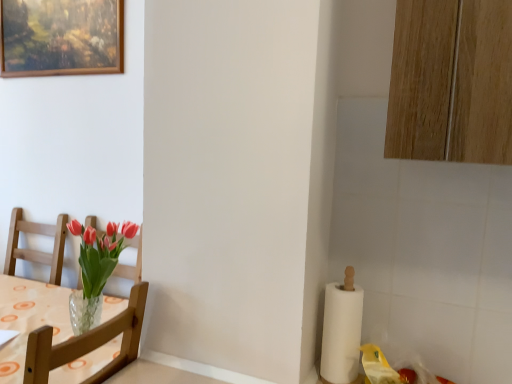
Where is `white paper at right`? This screenshot has height=384, width=512. white paper at right is located at coordinates (341, 333).

Image resolution: width=512 pixels, height=384 pixels. What do you see at coordinates (341, 333) in the screenshot? I see `white paper at right` at bounding box center [341, 333].

Where is `wooden chair at left`? The image size is (512, 384). wooden chair at left is located at coordinates (88, 343).

Considering the relative sizes of wooden-framed painting at upper left and white paper at right in the image provided, is wooden-framed painting at upper left taller than white paper at right?

Indeed, wooden-framed painting at upper left has a greater height compared to white paper at right.

Is point (15, 71) positioned after point (340, 310)?

Yes.

Would you say wooden-framed painting at upper left contains white paper at right?

No, white paper at right is not inside wooden-framed painting at upper left.

Which object is positioned more to the left, wooden-framed painting at upper left or white paper at right?

Positioned to the left is wooden-framed painting at upper left.

Is wooden chair at left bigger than wooden-framed painting at upper left?

Yes, wooden chair at left is bigger than wooden-framed painting at upper left.

Considering the sizes of wooden chair at left and wooden-framed painting at upper left in the image, is wooden chair at left wider or thinner than wooden-framed painting at upper left?

In the image, wooden chair at left appears to be wider than wooden-framed painting at upper left.

From a real-world perspective, is wooden chair at left physically below wooden-framed painting at upper left?

Yes, from a real-world perspective, wooden chair at left is beneath wooden-framed painting at upper left.

Between wooden chair at left and wooden-framed painting at upper left, which one appears on the left side from the viewer's perspective?

wooden-framed painting at upper left is more to the left.

Is wooden-framed painting at upper left aimed at wooden chair at left?

No, wooden-framed painting at upper left is not facing towards wooden chair at left.

Considering the relative positions of wooden-framed painting at upper left and wooden chair at left in the image provided, is wooden-framed painting at upper left behind wooden chair at left?

Yes, it is behind wooden chair at left.

Between wooden-framed painting at upper left and wooden chair at left, which one has smaller width?

With smaller width is wooden-framed painting at upper left.

Is wooden chair at left positioned beyond the bounds of white paper at right?

Yes, wooden chair at left is outside of white paper at right.

Is wooden chair at left to the left of white paper at right from the viewer's perspective?

Yes.

Can you tell me how much wooden chair at left and white paper at right differ in facing direction?

The angle between the facing direction of wooden chair at left and the facing direction of white paper at right is 88 degrees.

Is the depth of wooden chair at left less than that of white paper at right?

Yes, it is in front of white paper at right.

Based on the photo, is the depth of white paper at right less than that of wooden chair at left?

No, white paper at right is behind wooden chair at left.

Is white paper at right facing towards wooden chair at left?

No, white paper at right does not turn towards wooden chair at left.

Between white paper at right and wooden chair at left, which one has larger size?

wooden chair at left is bigger.

Which is behind, point (337, 298) or point (78, 346)?

Point (337, 298)

Is white paper at right smaller than wooden-framed painting at upper left?

Yes, white paper at right is smaller than wooden-framed painting at upper left.

From a real-world perspective, which object rests below the other?

In real-world perspective, white paper at right is lower.

Is white paper at right directly adjacent to wooden-framed painting at upper left?

There is a gap between white paper at right and wooden-framed painting at upper left.

Identify the location of picture frame that is behind the white paper at right. (61, 37).

Locate an element on the screen. Image resolution: width=512 pixels, height=384 pixels. picture frame on the left of the wooden chair at left is located at coordinates (61, 37).

Looking at the image, which one is located further to wooden chair at left, wooden-framed painting at upper left or white paper at right?

The object further to wooden chair at left is wooden-framed painting at upper left.

Estimate the real-world distances between objects in this image. Which object is further from wooden-framed painting at upper left, wooden chair at left or white paper at right?

white paper at right is further to wooden-framed painting at upper left.

Looking at the image, which one is located closer to wooden chair at left, white paper at right or wooden-framed painting at upper left?

white paper at right lies closer to wooden chair at left than the other object.

Considering their positions, is wooden chair at left positioned further to white paper at right than wooden-framed painting at upper left?

wooden-framed painting at upper left is positioned further to the anchor white paper at right.

Which object lies nearer to the anchor point wooden-framed painting at upper left, white paper at right or wooden chair at left?

The object closer to wooden-framed painting at upper left is wooden chair at left.

Which object lies further to the anchor point white paper at right, wooden-framed painting at upper left or wooden chair at left?

The object further to white paper at right is wooden-framed painting at upper left.

You are a GUI agent. You are given a task and a screenshot of the screen. Output one action in this format:
    pyautogui.click(x=<x>, y=<y>)
    Task: Click on the paper towel between wooden-framed painting at upper left and wooden chair at left in the up-down direction
    The image size is (512, 384).
    Given the screenshot: What is the action you would take?
    pyautogui.click(x=341, y=333)